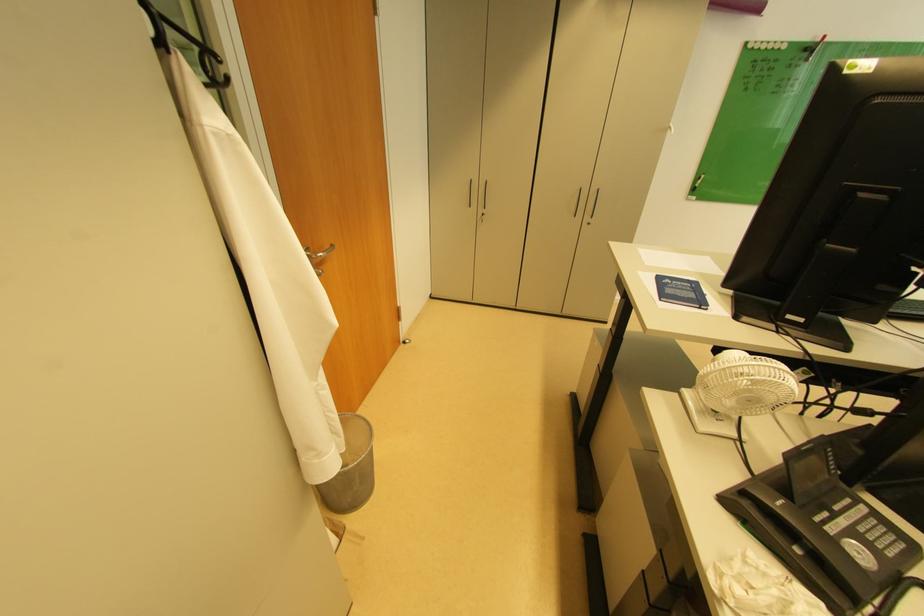
At what (x,y) coordinates should I click in order to perform the action: click on telephone handset. Please return your answer as a coordinate pair (x, y). Looking at the image, I should click on (813, 541).